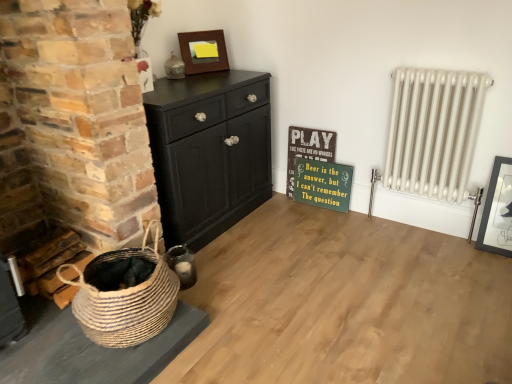
What do you see at coordinates (203, 51) in the screenshot?
I see `wooden picture frame at upper center, which is counted as the 1th picture frame, starting from the back` at bounding box center [203, 51].

This screenshot has height=384, width=512. What do you see at coordinates (125, 299) in the screenshot? I see `natural woven basket at lower left` at bounding box center [125, 299].

Measure the distance between point (421, 114) and camera.

The distance of point (421, 114) from camera is 6.55 feet.

Describe the element at coordinates (433, 131) in the screenshot. I see `white metal radiator at right` at that location.

You are a GUI agent. You are given a task and a screenshot of the screen. Output one action in this format:
    pyautogui.click(x=<x>, y=<y>)
    Task: Click on the wooden signboard at center
    
    Given the screenshot: What is the action you would take?
    pyautogui.click(x=308, y=149)

This screenshot has width=512, height=384. In order to click on bulletin board behind the black painted wood chest of drawers at left in this screenshot , I will do `click(308, 149)`.

How many degrees apart are the facing directions of black painted wood chest of drawers at left and wooden signboard at center?

The angle between the facing direction of black painted wood chest of drawers at left and the facing direction of wooden signboard at center is 88.9 degrees.

Considering the relative positions of black painted wood chest of drawers at left and wooden signboard at center in the image provided, is black painted wood chest of drawers at left to the left or to the right of wooden signboard at center?

black painted wood chest of drawers at left is to the left of wooden signboard at center.

Does black painted wood chest of drawers at left turn towards wooden signboard at center?

Yes.

Which is closer to the camera, (339,188) or (147,259)?

Point (339,188) appears to be farther away from the viewer than point (147,259).

From the image's perspective, is green painted wood signboard at center-right beneath natural woven basket at lower left?

No.

Can you tell me how much green painted wood signboard at center-right and natural woven basket at lower left differ in facing direction?

The angle between the facing direction of green painted wood signboard at center-right and the facing direction of natural woven basket at lower left is 87 degrees.

In terms of width, does wooden signboard at center look wider or thinner when compared to wooden picture frame at upper center, placed as the 1th picture frame when sorted from top to bottom?

wooden signboard at center is thinner than wooden picture frame at upper center, placed as the 1th picture frame when sorted from top to bottom.

Is wooden signboard at center in front of or behind wooden picture frame at upper center, placed as the second picture frame when sorted from front to back, in the image?

In the image, wooden signboard at center appears behind wooden picture frame at upper center, placed as the second picture frame when sorted from front to back.

Considering the points (314, 156) and (188, 61), which point is in front, point (314, 156) or point (188, 61)?

Positioned in front is point (188, 61).

Based on their positions, is wooden signboard at center located to the left or right of green painted wood signboard at center-right?

Based on their positions, wooden signboard at center is located to the left of green painted wood signboard at center-right.

Measure the distance from wooden signboard at center to green painted wood signboard at center-right.

A distance of 4.64 inches exists between wooden signboard at center and green painted wood signboard at center-right.

Who is smaller, wooden signboard at center or green painted wood signboard at center-right?

green painted wood signboard at center-right is smaller.

Is wooden signboard at center outside of green painted wood signboard at center-right?

No, wooden signboard at center is inside or overlapping with green painted wood signboard at center-right.

Between wooden picture frame at upper center, the second picture frame from the bottom, and black painted wood chest of drawers at left, which one appears on the left side from the viewer's perspective?

black painted wood chest of drawers at left is more to the left.

Is wooden picture frame at upper center, marked as the second picture frame in a right-to-left arrangement, positioned beyond the bounds of black painted wood chest of drawers at left?

That's correct, wooden picture frame at upper center, marked as the second picture frame in a right-to-left arrangement, is outside of black painted wood chest of drawers at left.

The height and width of the screenshot is (384, 512). I want to click on picture frame above the black painted wood chest of drawers at left (from a real-world perspective), so tap(203, 51).

Which of these two, green painted wood signboard at center-right or white metal radiator at right, is smaller?

green painted wood signboard at center-right is smaller.

Based on the photo, from the image's perspective, is green painted wood signboard at center-right below white metal radiator at right?

Correct, green painted wood signboard at center-right appears lower than white metal radiator at right in the image.

Considering the relative positions of green painted wood signboard at center-right and white metal radiator at right in the image provided, is green painted wood signboard at center-right to the right of white metal radiator at right from the viewer's perspective?

Incorrect, green painted wood signboard at center-right is not on the right side of white metal radiator at right.

Which is less distant, (344,168) or (465,112)?

Point (344,168) is farther from the camera than point (465,112).

Which of these two, wooden signboard at center or white metal radiator at right, is wider?

With larger width is white metal radiator at right.

Based on the photo, is the surface of wooden signboard at center in direct contact with white metal radiator at right?

No, wooden signboard at center is not in contact with white metal radiator at right.

Consider the image. Does wooden signboard at center have a smaller size compared to white metal radiator at right?

Yes.

Find the location of a particular element. The width and height of the screenshot is (512, 384). chest of drawers above the wooden signboard at center (from the image's perspective) is located at coordinates (209, 151).

The height and width of the screenshot is (384, 512). Identify the location of plaque below the natural woven basket at lower left (from a real-world perspective). (323, 184).

Which object lies nearer to the anchor point white metal radiator at right, natural woven basket at lower left or wooden signboard at center?

wooden signboard at center is closer to white metal radiator at right.

Estimate the real-world distances between objects in this image. Which object is closer to black painted wood chest of drawers at left, matte black picture frame at right, acting as the 1th picture frame starting from the right, or natural woven basket at lower left?

natural woven basket at lower left is closer to black painted wood chest of drawers at left.

Estimate the real-world distances between objects in this image. Which object is further from white metal radiator at right, green painted wood signboard at center-right or wooden signboard at center?

wooden signboard at center lies further to white metal radiator at right than the other object.

From the picture: When comparing their distances from green painted wood signboard at center-right, does white metal radiator at right or wooden picture frame at upper center, placed as the second picture frame when sorted from front to back, seem further?

wooden picture frame at upper center, placed as the second picture frame when sorted from front to back, is further to green painted wood signboard at center-right.

Considering their positions, is black painted wood chest of drawers at left positioned closer to natural woven basket at lower left than green painted wood signboard at center-right?

black painted wood chest of drawers at left is positioned closer to the anchor natural woven basket at lower left.

Considering their positions, is white metal radiator at right positioned closer to green painted wood signboard at center-right than natural woven basket at lower left?

Based on the image, white metal radiator at right appears to be nearer to green painted wood signboard at center-right.

When comparing their distances from white metal radiator at right, does wooden signboard at center or natural woven basket at lower left seem further?

natural woven basket at lower left is further to white metal radiator at right.

Looking at this image, which object lies further to the anchor point natural woven basket at lower left, black painted wood chest of drawers at left or wooden signboard at center?

Based on the image, wooden signboard at center appears to be further to natural woven basket at lower left.

The height and width of the screenshot is (384, 512). I want to click on plaque between wooden signboard at center and matte black picture frame at right, the 1th picture frame when ordered from front to back, in the horizontal direction, so click(x=323, y=184).

Find the location of a particular element. This screenshot has height=384, width=512. radiator situated between black painted wood chest of drawers at left and matte black picture frame at right, acting as the 1th picture frame starting from the right, from left to right is located at coordinates (433, 131).

Find the location of `radiator between natural woven basket at lower left and matte black picture frame at right, the 1th picture frame when ordered from front to back`. radiator between natural woven basket at lower left and matte black picture frame at right, the 1th picture frame when ordered from front to back is located at coordinates (433, 131).

Locate an element on the screen. This screenshot has width=512, height=384. the chest of drawers positioned between natural woven basket at lower left and wooden signboard at center from near to far is located at coordinates (209, 151).